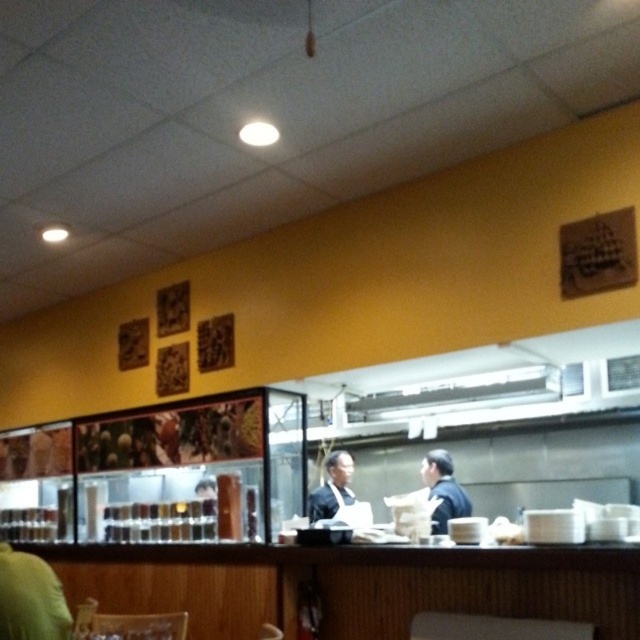
Who is higher up, dark blue uniform at center or dark blue suit at center?

Positioned higher is dark blue uniform at center.

Does dark blue uniform at center come in front of dark blue suit at center?

Yes.

Image resolution: width=640 pixels, height=640 pixels. I want to click on dark blue uniform at center, so click(444, 490).